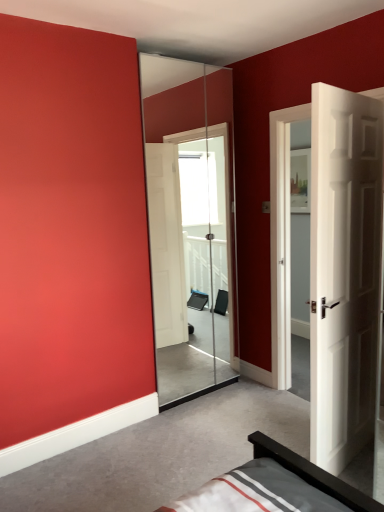
What do you see at coordinates (344, 272) in the screenshot? Image resolution: width=384 pixels, height=512 pixels. I see `white wooden door at right` at bounding box center [344, 272].

Where is `white wooden door at right`? white wooden door at right is located at coordinates (344, 272).

Identify the location of transparent glass screen door at center. The height and width of the screenshot is (512, 384). (191, 224).

Describe the element at coordinates (191, 224) in the screenshot. I see `transparent glass screen door at center` at that location.

At what (x,y) coordinates should I click in order to perform the action: click on white wooden door at right. Please return your answer as a coordinate pair (x, y). This screenshot has width=384, height=512. Looking at the image, I should click on (344, 272).

Is transparent glass screen door at center to the left of white wooden door at right from the viewer's perspective?

Indeed, transparent glass screen door at center is positioned on the left side of white wooden door at right.

Based on the photo, does transparent glass screen door at center come in front of white wooden door at right?

No, transparent glass screen door at center is further to the viewer.

Is point (183, 307) more distant than point (313, 336)?

That is True.

From the image's perspective, who appears lower, transparent glass screen door at center or white wooden door at right?

white wooden door at right is shown below in the image.

From the picture: From a real-world perspective, is transparent glass screen door at center above or below white wooden door at right?

In terms of real-world spatial position, transparent glass screen door at center is above white wooden door at right.

Can you confirm if transparent glass screen door at center is wider than white wooden door at right?

No, transparent glass screen door at center is not wider than white wooden door at right.

Between transparent glass screen door at center and white wooden door at right, which one has less height?

Standing shorter between the two is white wooden door at right.

Between transparent glass screen door at center and white wooden door at right, which one has smaller size?

With smaller size is transparent glass screen door at center.

Is transparent glass screen door at center completely or partially outside of white wooden door at right?

Absolutely, transparent glass screen door at center is external to white wooden door at right.

Can you see transparent glass screen door at center touching white wooden door at right?

No, transparent glass screen door at center is not beside white wooden door at right.

Could you tell me if transparent glass screen door at center is facing white wooden door at right?

Yes, transparent glass screen door at center is facing white wooden door at right.

What are the coordinates of `screen door on the left of white wooden door at right` in the screenshot? It's located at (191, 224).

Is white wooden door at right to the left of transparent glass screen door at center from the viewer's perspective?

No.

Considering the positions of objects white wooden door at right and transparent glass screen door at center in the image provided, who is in front, white wooden door at right or transparent glass screen door at center?

white wooden door at right is more forward.

Is point (317, 196) positioned after point (200, 122)?

No, it is not.

From the image's perspective, relative to transparent glass screen door at center, is white wooden door at right above or below?

Based on their image positions, white wooden door at right is located beneath transparent glass screen door at center.

From a real-world perspective, which is physically above, white wooden door at right or transparent glass screen door at center?

transparent glass screen door at center.

Which of these two, white wooden door at right or transparent glass screen door at center, is wider?

white wooden door at right is wider.

Can you confirm if white wooden door at right is shorter than transparent glass screen door at center?

Indeed, white wooden door at right has a lesser height compared to transparent glass screen door at center.

Does white wooden door at right have a smaller size compared to transparent glass screen door at center?

Incorrect, white wooden door at right is not smaller in size than transparent glass screen door at center.

Based on the photo, is white wooden door at right inside the boundaries of transparent glass screen door at center, or outside?

white wooden door at right is outside transparent glass screen door at center.

Can you see white wooden door at right touching transparent glass screen door at center?

No, white wooden door at right is not making contact with transparent glass screen door at center.

Does white wooden door at right turn towards transparent glass screen door at center?

Yes, white wooden door at right is aimed at transparent glass screen door at center.

How different are the orientations of white wooden door at right and transparent glass screen door at center in degrees?

The angle between the facing direction of white wooden door at right and the facing direction of transparent glass screen door at center is 171 degrees.

Measure the distance between white wooden door at right and transparent glass screen door at center.

They are 1.73 meters apart.

The width and height of the screenshot is (384, 512). I want to click on door that is in front of the transparent glass screen door at center, so 344,272.

Where is `door on the right of the transparent glass screen door at center`? door on the right of the transparent glass screen door at center is located at coordinates (344, 272).

Find the location of a particular element. This screenshot has height=512, width=384. screen door located above the white wooden door at right (from a real-world perspective) is located at coordinates click(x=191, y=224).